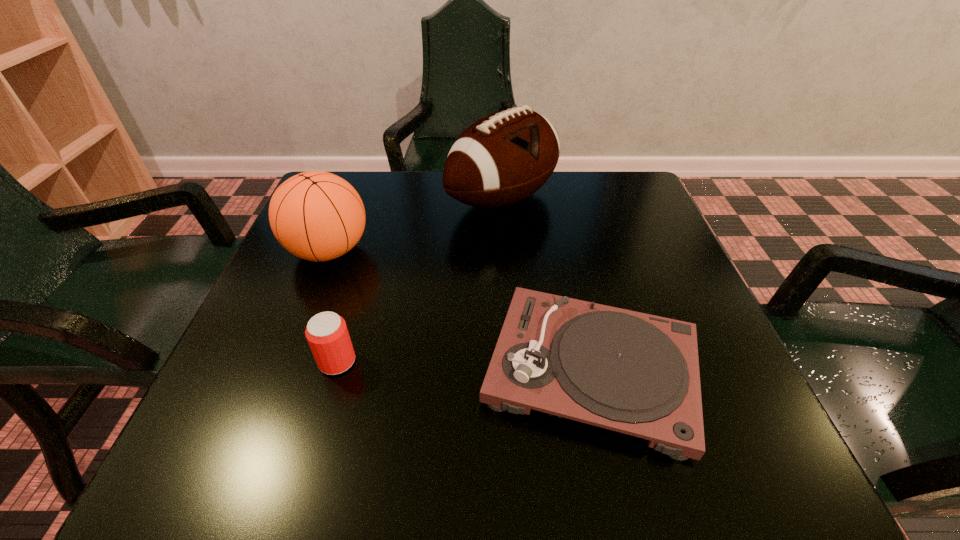
Where is `object that stands as the third closest to the basketball`? Image resolution: width=960 pixels, height=540 pixels. object that stands as the third closest to the basketball is located at coordinates (630, 372).

Locate an element on the screen. The image size is (960, 540). object that is the closest to the beer can is located at coordinates (318, 216).

The width and height of the screenshot is (960, 540). Identify the location of free space that satisfies the following two spatial constraints: 1. on the back side of the second shortest object; 2. on the left side of the football (American). (384, 199).

Where is `vacant space that satisfies the following two spatial constraints: 1. on the front side of the beer can; 2. on the left side of the shortest object`? vacant space that satisfies the following two spatial constraints: 1. on the front side of the beer can; 2. on the left side of the shortest object is located at coordinates (335, 369).

Where is `vacant space that satisfies the following two spatial constraints: 1. on the back side of the second shortest object; 2. on the left side of the football (American)`? This screenshot has height=540, width=960. vacant space that satisfies the following two spatial constraints: 1. on the back side of the second shortest object; 2. on the left side of the football (American) is located at coordinates (384, 199).